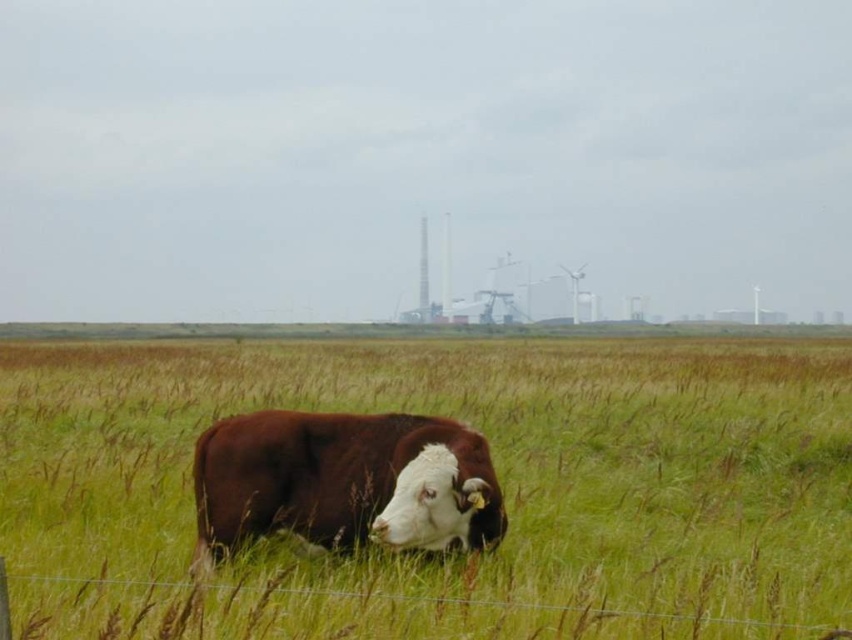
Between point (159, 550) and point (442, 467), which one is positioned in front?

Positioned in front is point (442, 467).

Which of these two, green grassy field at center or brown matte cow at center, stands taller?

green grassy field at center is taller.

The width and height of the screenshot is (852, 640). Identify the location of green grassy field at center. (x=498, y=476).

Identify the location of green grassy field at center. (498, 476).